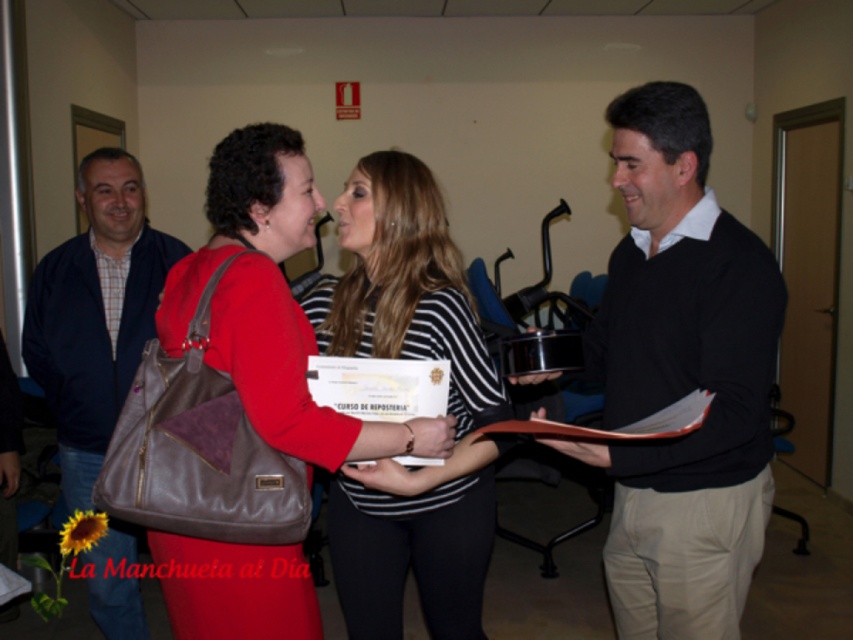
Can you confirm if matte brown bag at center is thinner than dark blue jacket at left?

No, matte brown bag at center is not thinner than dark blue jacket at left.

Measure the distance between point (227, 198) and camera.

5.29 feet

Measure the distance between matte brown bag at center and camera.

The distance of matte brown bag at center from camera is 1.44 meters.

Find the location of a particular element. matte brown bag at center is located at coordinates pos(273,305).

Which is behind, point (425, 625) or point (244, 600)?

Point (425, 625)

Is striped fabric shirt at center positioned in front of matte brown bag at center?

That is False.

Locate an element on the screen. The image size is (853, 640). striped fabric shirt at center is located at coordinates (445, 410).

Between black sweater at center and matte brown bag at center, which one has more height?

With more height is black sweater at center.

Is black sweater at center behind matte brown bag at center?

Yes, it is behind matte brown bag at center.

Where is `black sweater at center`? black sweater at center is located at coordinates (682, 378).